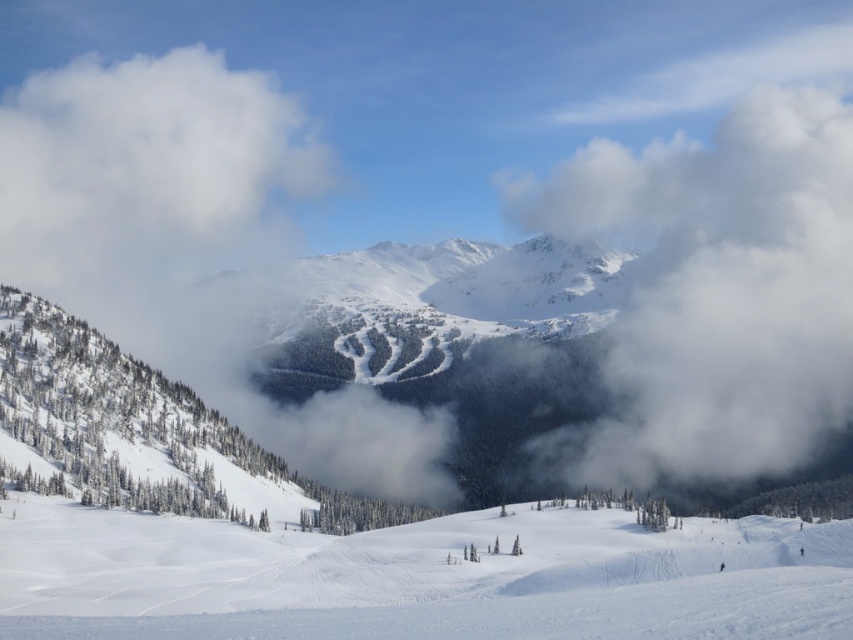
You are a drone operator planning to fly a drone between the white fluffy cloud at upper right and another cloud that is 239.28 meters away. What is the minimum distance you need to set the drone to safely navigate between them?

The minimum distance you need to set the drone is 239.28 meters to safely navigate between the white fluffy cloud at upper right and the other cloud.

You are a photographer planning to capture the white snow ski slope at lower center and the white fluffy cloud at upper left in a single frame. Based on their positions, which object should you adjust your camera to focus on first to ensure both are in the shot?

The white snow ski slope at lower center is to the right of the white fluffy cloud at upper left, so you should focus on the white fluffy cloud at upper left first to ensure both are in the frame.

You are a drone operator trying to capture aerial footage of the white snow ski slope at lower center. The drone has a GPS coordinate system where the bottom left corner is the origin point. The slope is located at coordinate point 0.905, 0.496. If the drone is currently at coordinate point 0.5, 0.5, which direction should you move the drone to reach the slope?

The white snow ski slope at lower center is located at coordinate point (422,579). Since the drone is at (426,320), you should move it to the right to increase the x coordinate from 0.5 to 0.905 and slightly downward to decrease the y coordinate from 0.5 to 0.496 to reach the slope.